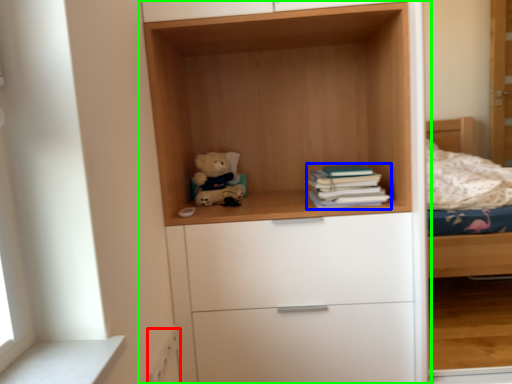
Question: Which object is positioned closest to drawer (highlighted by a red box)? Select from book (highlighted by a blue box) and cupboard (highlighted by a green box).

Choices:
 (A) book
 (B) cupboard

Answer: (A)